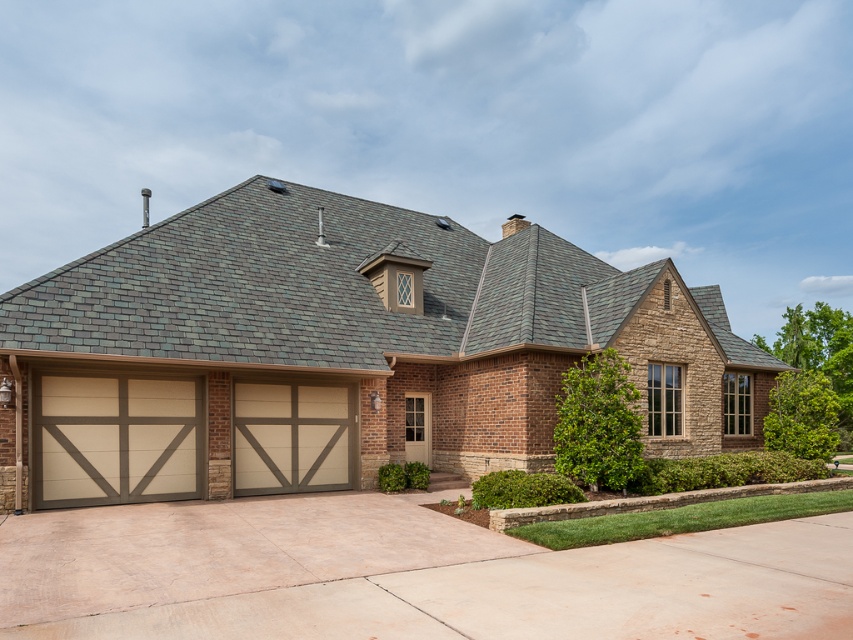
You are standing in front of the house and want to walk from the beige wood garage door at center to the concrete at center. Which direction should you move relative to the house?

You should move to the right relative to the house because the concrete at center is to the right of the beige wood garage door at center.

You are standing in front of the house and notice two points marked on its facade. The first point is at coordinates point (807, 612) and the second is at point (331, 442). Which point is closer to you?

Point (807, 612) is closer to the viewer than point (331, 442).